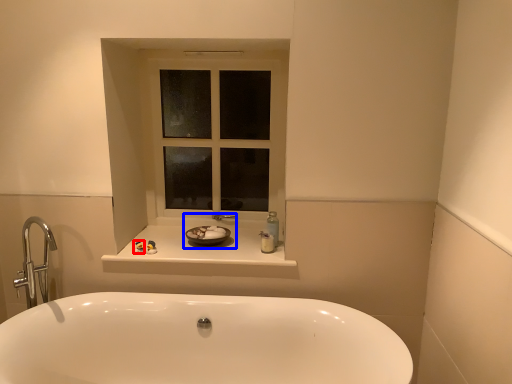
Question: Which of the following is the farthest to the observer, toiletry (highlighted by a red box) or sink (highlighted by a blue box)?

Choices:
 (A) toiletry
 (B) sink

Answer: (B)